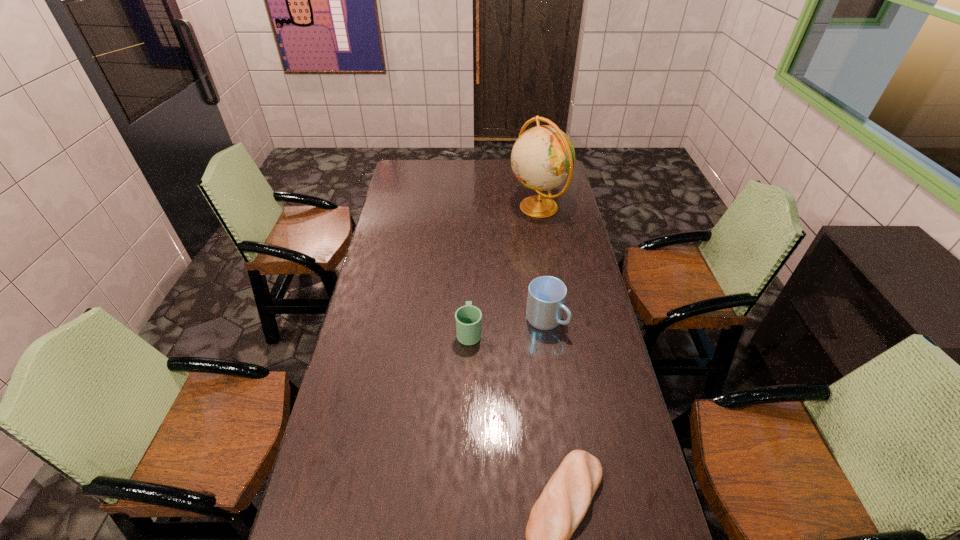
I want to click on free region located on the side of the leftmost object with the handle, so click(x=470, y=285).

The image size is (960, 540). I want to click on globe present at the right edge, so click(543, 157).

I want to click on mug present at the right edge, so coord(546,298).

The width and height of the screenshot is (960, 540). Identify the location of vacant region at the far edge of the desktop. (443, 161).

In the image, there is a desktop. Where is `vacant area at the left edge`? vacant area at the left edge is located at coordinates (391, 260).

Where is `vacant space at the right edge of the desktop`? This screenshot has width=960, height=540. vacant space at the right edge of the desktop is located at coordinates (587, 383).

Where is `blank region between the farthest object and the taller mug`? The width and height of the screenshot is (960, 540). blank region between the farthest object and the taller mug is located at coordinates (541, 264).

Where is `vacant area between the right mug and the shorter mug`? The height and width of the screenshot is (540, 960). vacant area between the right mug and the shorter mug is located at coordinates (507, 326).

This screenshot has height=540, width=960. Identify the location of vacant point located between the right mug and the farthest object. (541, 264).

Locate an element on the screen. Image resolution: width=960 pixels, height=540 pixels. blank region between the left mug and the tallest object is located at coordinates (503, 269).